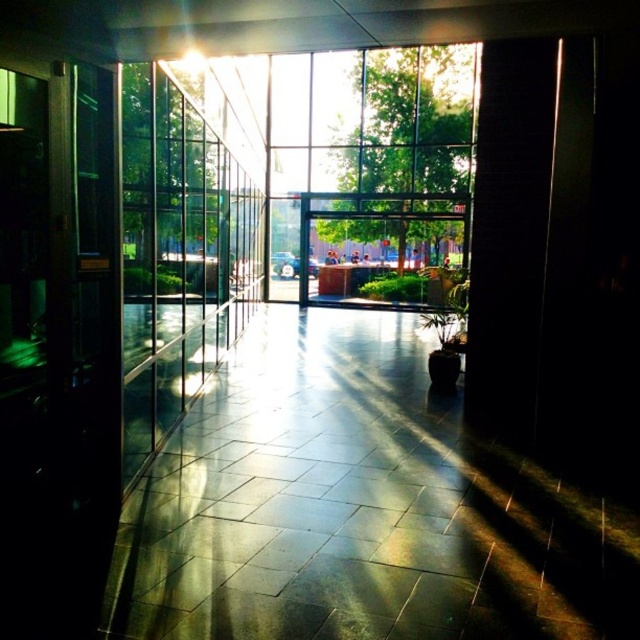
Question: Does transparent glass window at center have a smaller size compared to transparent glass door at left?

Choices:
 (A) no
 (B) yes

Answer: (A)

Question: Which of the following is the closest to the observer?

Choices:
 (A) (444, 198)
 (B) (170, 342)
 (C) (256, 605)

Answer: (C)

Question: Which point is closer to the camera?

Choices:
 (A) shiny tile floor at center
 (B) transparent glass door at left

Answer: (A)

Question: Which point appears farthest from the camera in this image?

Choices:
 (A) (337, 157)
 (B) (141, 259)
 (C) (356, 353)

Answer: (A)

Question: Observing the image, what is the correct spatial positioning of shiny tile floor at center in reference to transparent glass door at left?

Choices:
 (A) above
 (B) below

Answer: (B)

Question: Is shiny tile floor at center thinner than transparent glass window at center?

Choices:
 (A) yes
 (B) no

Answer: (B)